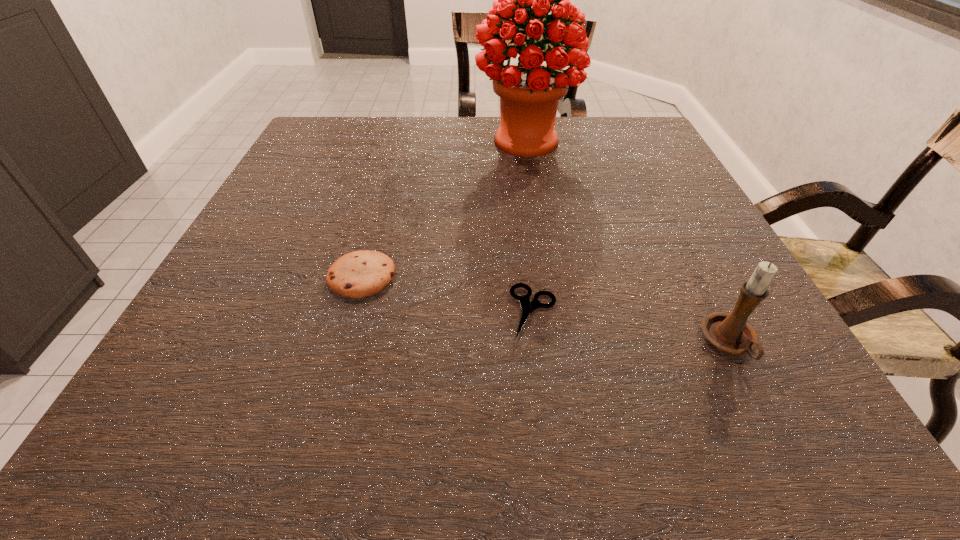
Identify the location of vacant space in between the tallest object and the shears. Image resolution: width=960 pixels, height=540 pixels. (530, 226).

Locate an element on the screen. This screenshot has width=960, height=540. vacant space that is in between the second tallest object and the shortest object is located at coordinates (632, 327).

You are a GUI agent. You are given a task and a screenshot of the screen. Output one action in this format:
    pyautogui.click(x=<x>, y=<y>)
    Task: Click on the free space between the shears and the bouquet
    The width and height of the screenshot is (960, 540).
    Given the screenshot: What is the action you would take?
    pyautogui.click(x=530, y=226)

I want to click on empty space that is in between the shortest object and the second tallest object, so click(632, 327).

This screenshot has height=540, width=960. I want to click on unoccupied area between the leftmost object and the bouquet, so click(444, 208).

Locate an element on the screen. free spot between the shortest object and the second tallest object is located at coordinates (x=632, y=327).

This screenshot has width=960, height=540. In order to click on vacant space that's between the third shortest object and the shortest object in this screenshot , I will do `click(632, 327)`.

Find the location of a particular element. Image resolution: width=960 pixels, height=540 pixels. vacant space that's between the shears and the candle holder is located at coordinates (632, 327).

Locate which object ranks second in proximity to the shears. Please provide its 2D coordinates. Your answer should be formatted as a tuple, i.e. [(x, y)], where the tuple contains the x and y coordinates of a point satisfying the conditions above.

[(730, 332)]

Where is `object that stands as the third closest to the shears`? This screenshot has width=960, height=540. object that stands as the third closest to the shears is located at coordinates (529, 91).